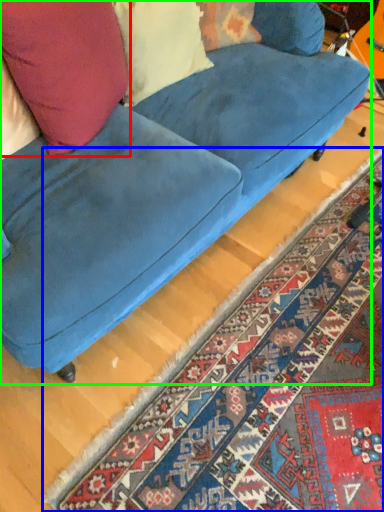
Question: Which object is the farthest from throw pillow (highlighted by a red box)? Choose among these: mat (highlighted by a blue box) or studio couch (highlighted by a green box).

Choices:
 (A) mat
 (B) studio couch

Answer: (A)